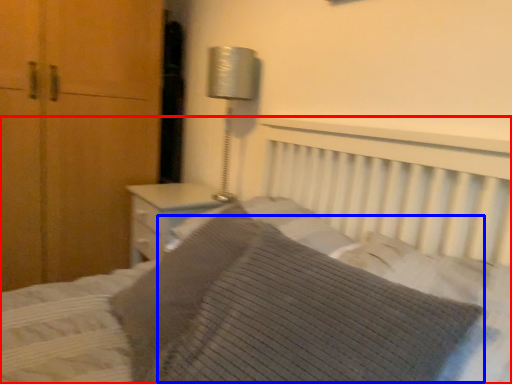
Question: Which object appears closest to the camera in this image, bed (highlighted by a red box) or pillow (highlighted by a blue box)?

Choices:
 (A) bed
 (B) pillow

Answer: (A)